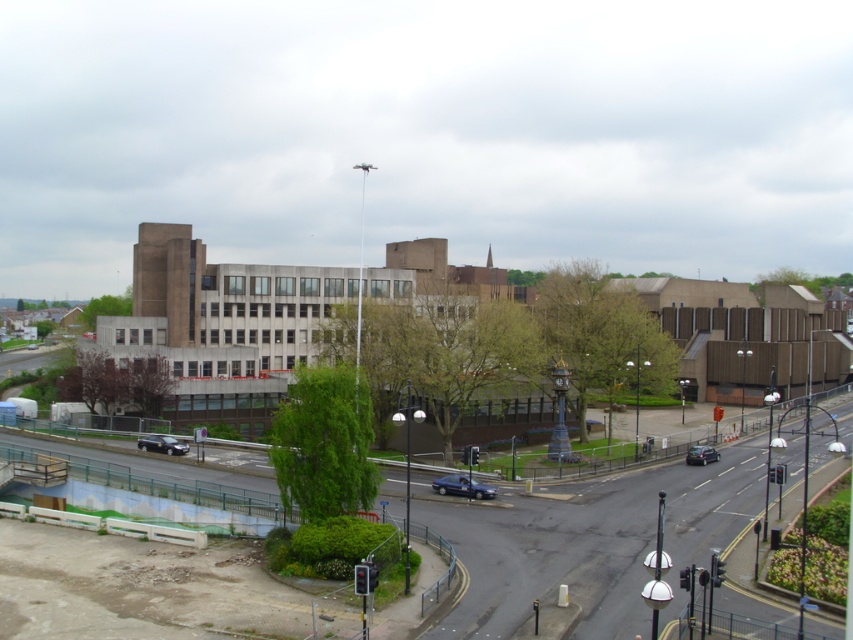
You are a parking attendant who needs to fit both the metallic blue sedan at center and the shiny black sedan at lower left into a parking spot that can only accommodate one vehicle at a time. Which vehicle should you prioritize to park first?

The metallic blue sedan at center is bigger than the shiny black sedan at lower left, so you should prioritize parking the metallic blue sedan at center first to ensure it fits in the available space.

From the picture: You are a delivery driver who needs to park your metallic blue sedan at center in the parking lot near the clock tower. The parking lot has a designated parking spot at point 0.761, 0.543. Is your car already parked in the correct spot?

Yes, the metallic blue sedan at center is already parked at point (462, 486), so it is in the correct parking spot.